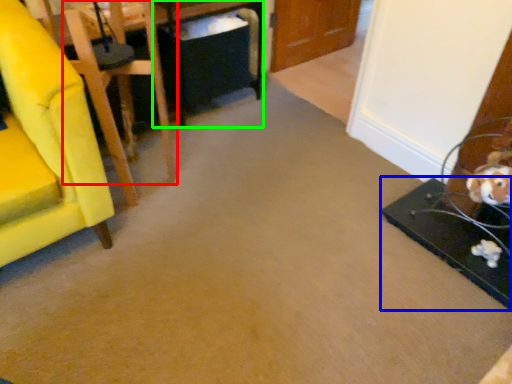
Question: Estimate the real-world distances between objects in this image. Which object is farther from chair (highlighted by a red box), table (highlighted by a blue box) or table (highlighted by a green box)?

Choices:
 (A) table
 (B) table

Answer: (A)